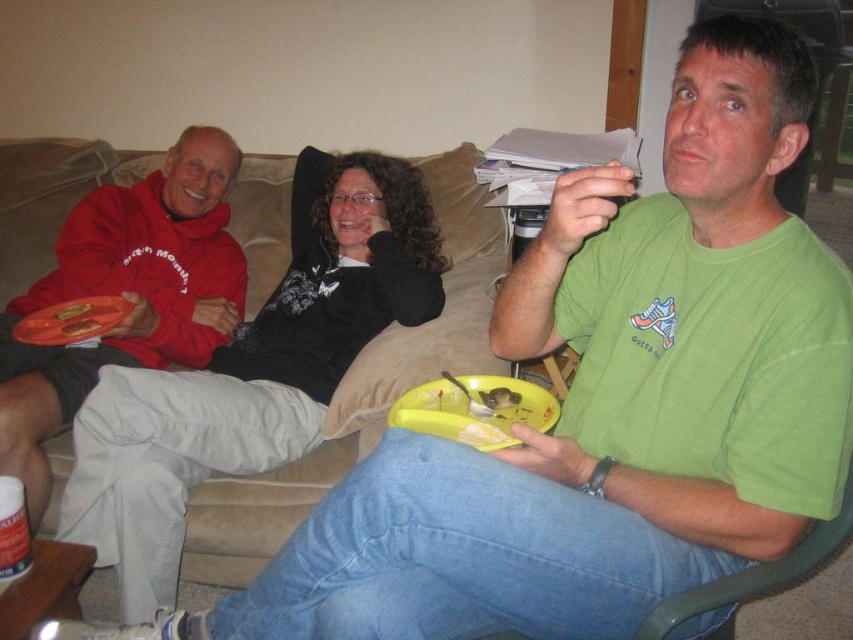
Question: Does yellow matte plate at lower center have a lesser width compared to matte orange plate at left?

Choices:
 (A) no
 (B) yes

Answer: (B)

Question: Which point appears farthest from the camera in this image?

Choices:
 (A) (125, 564)
 (B) (184, 353)
 (C) (77, 323)

Answer: (B)

Question: Is matte orange plate at left above matte plastic snack at center?

Choices:
 (A) yes
 (B) no

Answer: (B)

Question: Does black matte sweater at upper center appear under yellow matte plate at lower center?

Choices:
 (A) yes
 (B) no

Answer: (B)

Question: Estimate the real-world distances between objects in this image. Which object is closer to the matte red hoodie at left?

Choices:
 (A) matte plastic snack at center
 (B) black matte sweater at upper center
 (C) matte orange plate at left

Answer: (A)

Question: Which object is farther from the camera taking this photo?

Choices:
 (A) matte red hoodie at left
 (B) black matte sweater at upper center

Answer: (A)